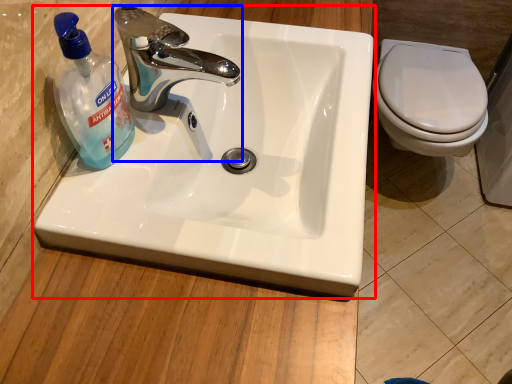
Question: Which of the following is the closest to the observer, sink (highlighted by a red box) or tap (highlighted by a blue box)?

Choices:
 (A) sink
 (B) tap

Answer: (A)